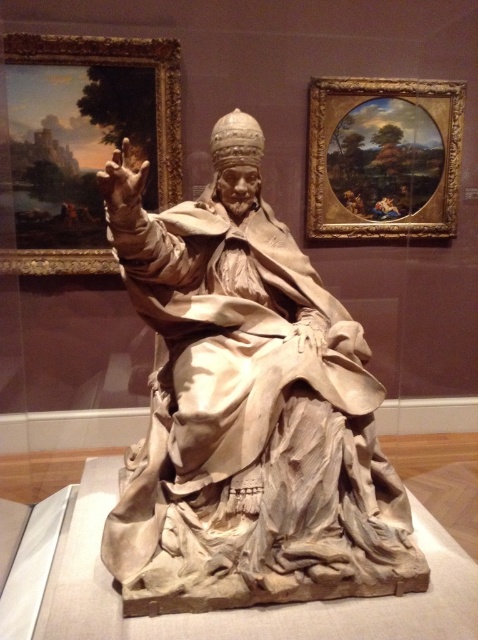
You are an art conservator examining the image. You need to determine the position of the white marble statue at center relative to the two framed paintings. Based on the coordinates provided, which painting is closer to the statue?

The white marble statue at center is located at coordinates point (248, 410). Since the left painting is on the left side and the right painting is on the right side, the statue is positioned closer to the right painting because its x coordinate 0.642 is closer to the right side of the image.